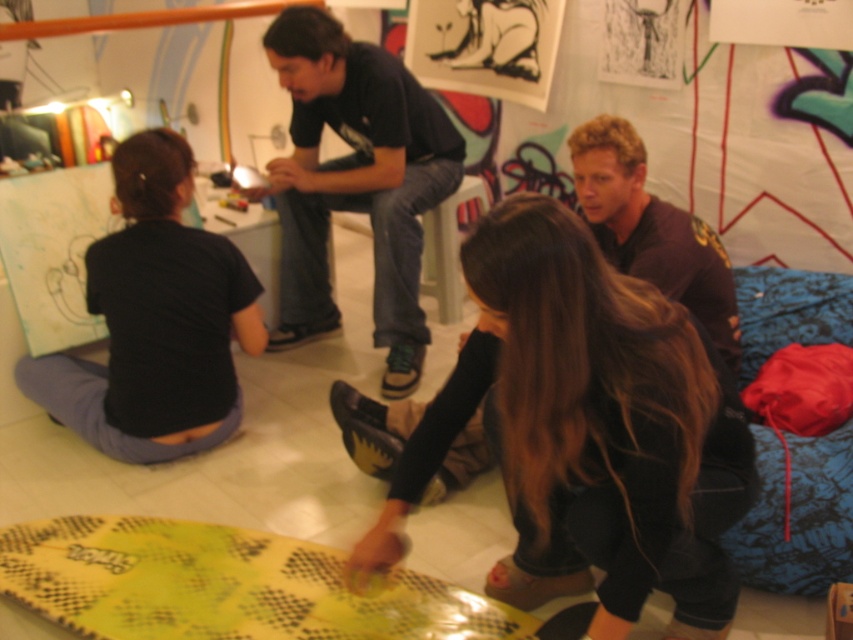
Question: Is yellow textured surfboard at lower center below black matte shirt at lower left?

Choices:
 (A) yes
 (B) no

Answer: (A)

Question: Which of the following is the closest to the observer?

Choices:
 (A) black cotton shirt at upper center
 (B) black matte shirt at lower left
 (C) yellow textured surfboard at lower center

Answer: (C)

Question: Does black matte shirt at lower left appear on the right side of black cotton shirt at upper center?

Choices:
 (A) yes
 (B) no

Answer: (B)

Question: Considering the relative positions of yellow textured surfboard at lower center and black cotton shirt at upper center in the image provided, where is yellow textured surfboard at lower center located with respect to black cotton shirt at upper center?

Choices:
 (A) below
 (B) above

Answer: (A)

Question: Which object is positioned closest to the smooth black pants at lower center?

Choices:
 (A) black cotton shirt at upper center
 (B) black matte shirt at lower left

Answer: (B)

Question: Which object is farther from the camera taking this photo?

Choices:
 (A) smooth black pants at lower center
 (B) yellow textured surfboard at lower center

Answer: (B)